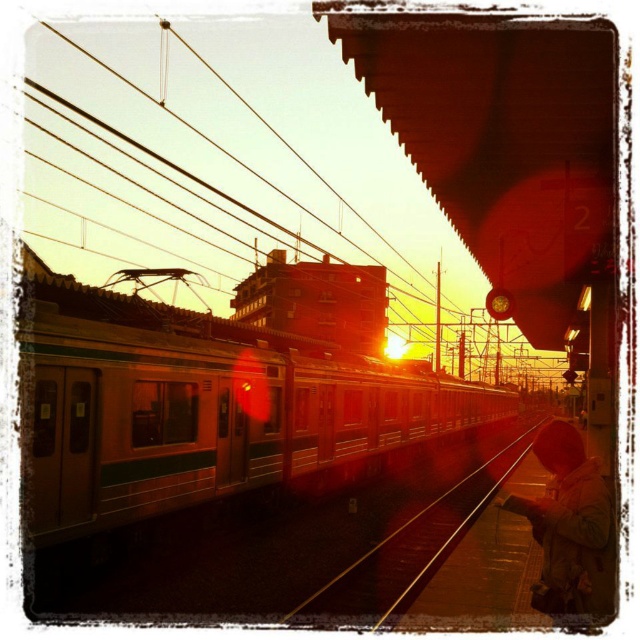
Question: Is brown woolen coat at lower right wider than metal train track at center?

Choices:
 (A) yes
 (B) no

Answer: (B)

Question: Is metallic wire at upper center thinner than metal train track at center?

Choices:
 (A) yes
 (B) no

Answer: (B)

Question: Which object appears closest to the camera in this image?

Choices:
 (A) metal train track at center
 (B) green metallic train at center

Answer: (B)

Question: Considering the relative positions of metallic wire at upper center and metal train track at center in the image provided, where is metallic wire at upper center located with respect to metal train track at center?

Choices:
 (A) above
 (B) below

Answer: (A)

Question: Which of the following is the farthest from the observer?

Choices:
 (A) green metallic train at center
 (B) metallic wire at upper center
 (C) brown woolen coat at lower right

Answer: (B)

Question: Which object is farther from the camera taking this photo?

Choices:
 (A) metallic wire at upper center
 (B) green metallic train at center
 (C) brown woolen coat at lower right
 (D) metal train track at center

Answer: (A)